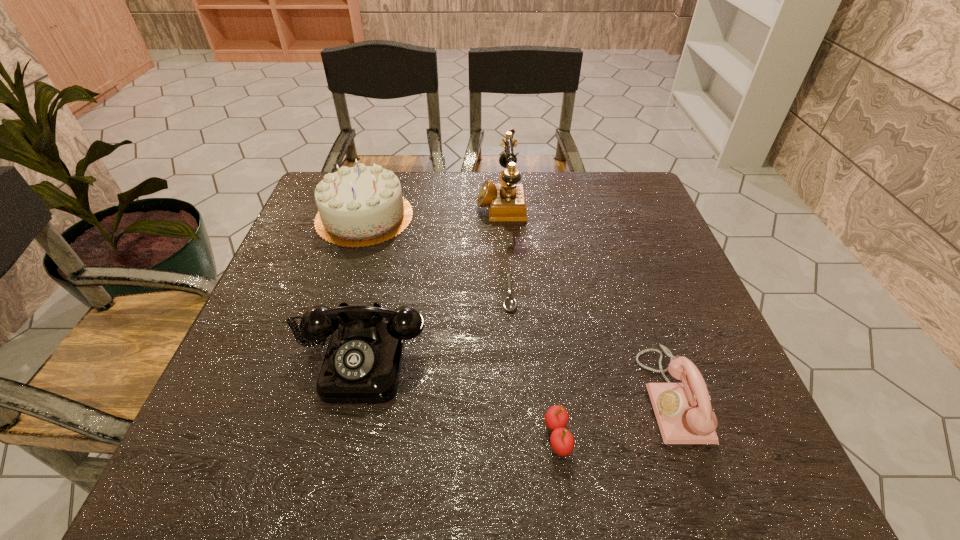
Locate an element on the screen. Image resolution: width=960 pixels, height=540 pixels. empty location between the tallest telephone and the second tallest object is located at coordinates (433, 209).

Identify the location of free space between the tallest object and the soupspoon. (505, 248).

Locate an element on the screen. This screenshot has height=540, width=960. empty location between the fourth nearest object and the tallest telephone is located at coordinates (505, 248).

Locate which object is the third closest to the rightmost object. Please provide its 2D coordinates. Your answer should be formatted as a tuple, i.e. [(x, y)], where the tuple contains the x and y coordinates of a point satisfying the conditions above.

[(362, 364)]

Locate which object is the fourth closest to the tallest telephone. Please provide its 2D coordinates. Your answer should be formatted as a tuple, i.e. [(x, y)], where the tuple contains the x and y coordinates of a point satisfying the conditions above.

[(683, 411)]

Identify which telephone is the nearest to the third farthest object. Please provide its 2D coordinates. Your answer should be formatted as a tuple, i.e. [(x, y)], where the tuple contains the x and y coordinates of a point satisfying the conditions above.

[(362, 364)]

This screenshot has height=540, width=960. I want to click on telephone identified as the closest to the leftmost telephone, so [x=506, y=201].

Where is `vacant space that satisfies the following two spatial constraints: 1. on the dial number of the shortest object; 2. on the left side of the farthest telephone`? The height and width of the screenshot is (540, 960). vacant space that satisfies the following two spatial constraints: 1. on the dial number of the shortest object; 2. on the left side of the farthest telephone is located at coordinates point(506,294).

Image resolution: width=960 pixels, height=540 pixels. Identify the location of free space that satisfies the following two spatial constraints: 1. on the dial number of the second telephone from left to right; 2. on the back side of the soupspoon. (506, 294).

In order to click on blank space that satisfies the following two spatial constraints: 1. on the front side of the soupspoon; 2. on the left side of the fifth tallest object in this screenshot , I will do `click(519, 436)`.